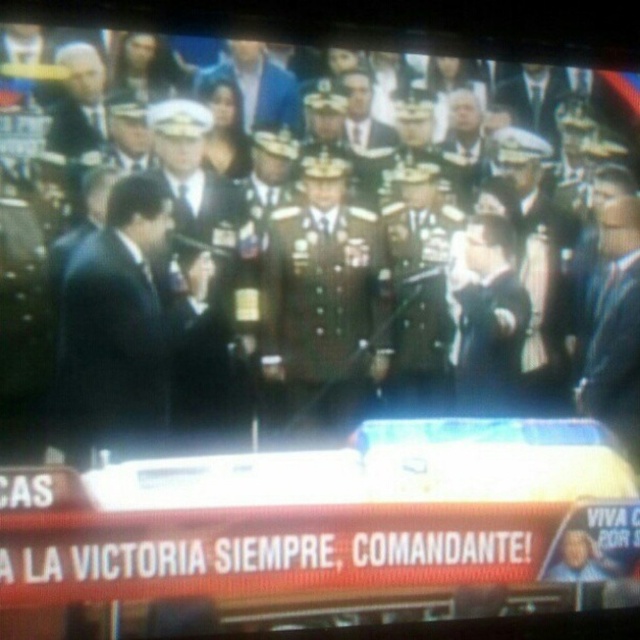
The width and height of the screenshot is (640, 640). What do you see at coordinates (324, 300) in the screenshot? I see `shiny gold uniform at center` at bounding box center [324, 300].

Between shiny gold uniform at center and satin blue suit at right, which one appears on the left side from the viewer's perspective?

shiny gold uniform at center is more to the left.

Image resolution: width=640 pixels, height=640 pixels. Find the location of `shiny gold uniform at center`. shiny gold uniform at center is located at coordinates (324, 300).

Find the location of a particular element. This screenshot has width=640, height=640. shiny gold uniform at center is located at coordinates (324, 300).

Does shiny gold uniform at center appear under blue fabric jacket at center?

Correct, shiny gold uniform at center is located below blue fabric jacket at center.

Between point (321, 337) and point (266, 128), which one is positioned in front?

Point (266, 128) is more forward.

Identify the location of shiny gold uniform at center. This screenshot has width=640, height=640. (324, 300).

Who is lower down, satin blue suit at right or blue fabric jacket at center?

Positioned lower is satin blue suit at right.

Does point (637, 237) come in front of point (284, 76)?

No, it is not.

Is point (609, 328) closer to camera compared to point (291, 76)?

No, it is behind (291, 76).

Find the location of a particular element. This screenshot has height=640, width=640. satin blue suit at right is located at coordinates (612, 324).